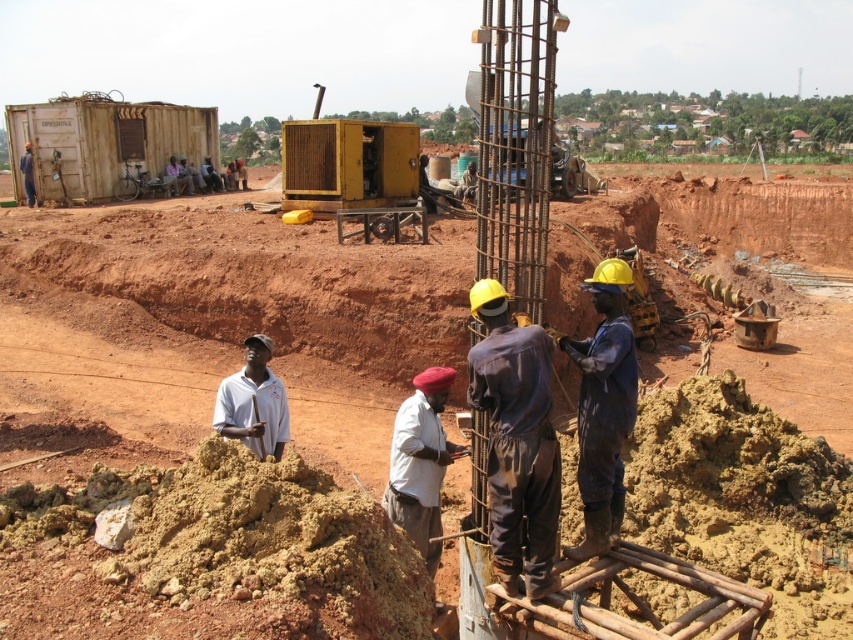
From the picture: Which is below, blue coveralls at center or white matte shirt at center?

white matte shirt at center

Does blue coveralls at center have a smaller size compared to white matte shirt at center?

Incorrect, blue coveralls at center is not smaller in size than white matte shirt at center.

Identify the location of blue coveralls at center. Image resolution: width=853 pixels, height=640 pixels. (602, 406).

Locate an element on the screen. This screenshot has width=853, height=640. white matte shirt at center is located at coordinates (253, 403).

In the scene shown: Which is below, white matte shirt at center or dark blue jumpsuit at center?

white matte shirt at center is lower down.

The image size is (853, 640). I want to click on white matte shirt at center, so (x=253, y=403).

I want to click on white matte shirt at center, so click(253, 403).

Who is more forward, (x=395, y=496) or (x=236, y=416)?

Point (x=395, y=496) is more forward.

Is white fabric at center above white matte shirt at center?

Actually, white fabric at center is below white matte shirt at center.

Locate an element on the screen. This screenshot has height=640, width=853. white fabric at center is located at coordinates (421, 464).